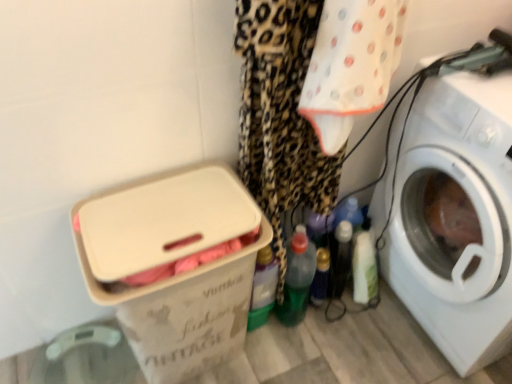
Question: Does point (322, 248) appear closer or farther from the camera than point (286, 271)?

Choices:
 (A) closer
 (B) farther

Answer: (B)

Question: Is translucent plastic bottle at center, the third bottle viewed from the left, inside the boundaries of green plastic bottle at center, which is counted as the second bottle, starting from the right, or outside?

Choices:
 (A) inside
 (B) outside

Answer: (B)

Question: Based on their relative distances, which object is nearer to the translucent plastic bottle at center, the third bottle viewed from the left?

Choices:
 (A) green translucent bottle at center, arranged as the 3th bottle when viewed from the right
 (B) white plastic box at lower left
 (C) white plastic washing machine at right
 (D) green plastic bottle at center, which is counted as the second bottle, starting from the right

Answer: (D)

Question: Estimate the real-world distances between objects in this image. Which object is farther from the white plastic washing machine at right?

Choices:
 (A) green plastic bottle at center, which is counted as the second bottle, starting from the right
 (B) green translucent bottle at center, which is the 1th bottle from left to right
 (C) white plastic box at lower left
 (D) translucent plastic bottle at center, the third bottle viewed from the left

Answer: (C)